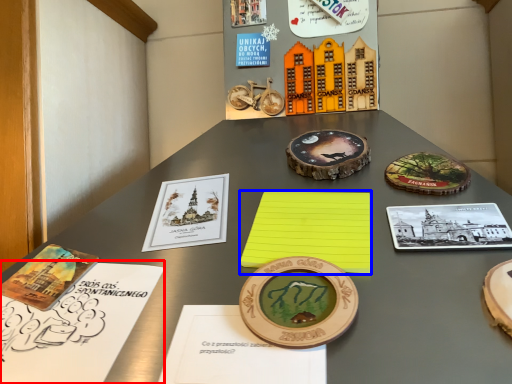
Question: Which object is further to the camera taking this photo, notebook (highlighted by a red box) or notebook (highlighted by a blue box)?

Choices:
 (A) notebook
 (B) notebook

Answer: (B)